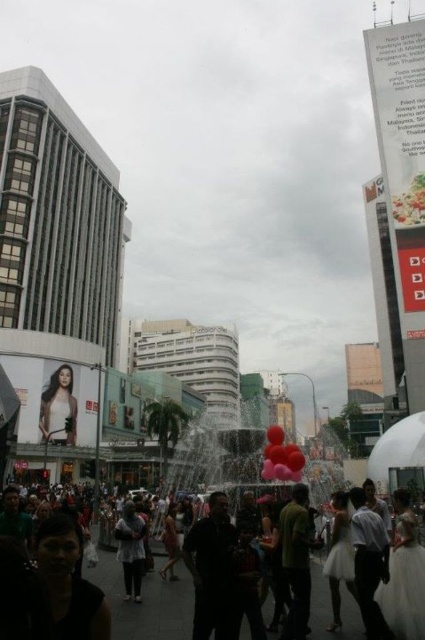
Question: Is matte black crowd at center thinner than rubber balloons at center?

Choices:
 (A) no
 (B) yes

Answer: (A)

Question: Is green matte shirt at center closer to camera compared to dark gray sweater at center?

Choices:
 (A) yes
 (B) no

Answer: (A)

Question: Which point is farther to the camera?

Choices:
 (A) dark gray sweater at center
 (B) matte black crowd at center
 (C) rubber balloons at center

Answer: (C)

Question: Which point is closer to the camera?

Choices:
 (A) (306, 580)
 (B) (116, 522)

Answer: (A)

Question: Which point is closer to the camera taking this photo?

Choices:
 (A) (121, 636)
 (B) (54, 432)

Answer: (A)

Question: Can you confirm if light gray shirt at lower right is wider than green matte shirt at center?

Choices:
 (A) no
 (B) yes

Answer: (B)